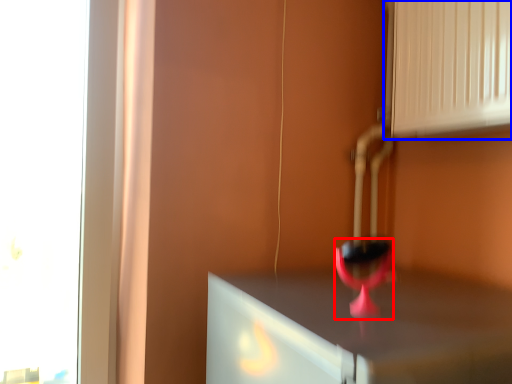
Question: Among these objects, which one is nearest to the camera, wine glass (highlighted by a red box) or vent (highlighted by a blue box)?

Choices:
 (A) wine glass
 (B) vent

Answer: (A)